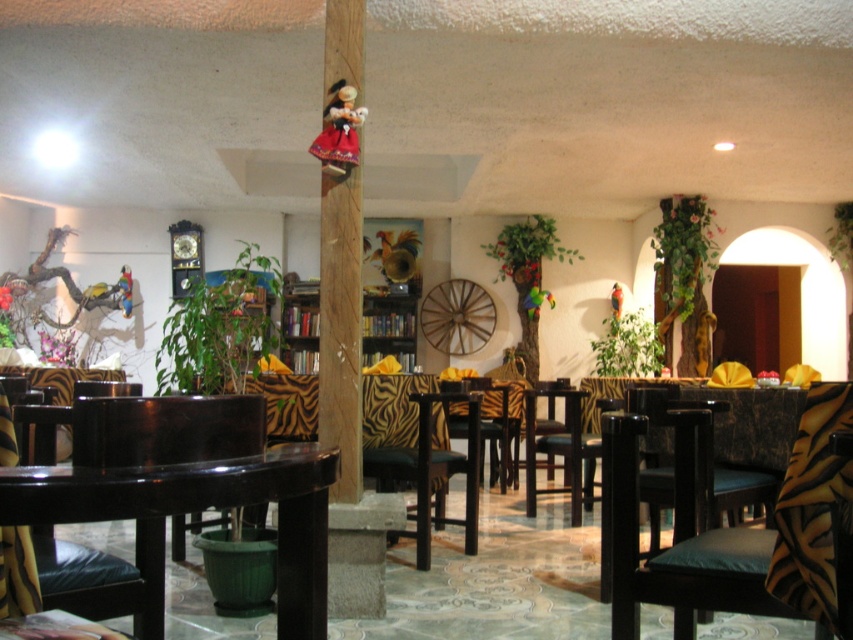
Who is positioned more to the right, glossy black table at lower left or zebra-patterned fabric armchair at center?

zebra-patterned fabric armchair at center

Does glossy black table at lower left have a greater height compared to zebra-patterned fabric armchair at center?

Incorrect, glossy black table at lower left's height is not larger of zebra-patterned fabric armchair at center's.

Who is more forward, [299,625] or [502,394]?

Positioned in front is point [299,625].

Identify the location of glossy black table at lower left. (196, 509).

Does point (190, 436) come farther from viewer compared to point (460, 432)?

No, it is not.

Identify the location of glossy wood armchair at center. This screenshot has height=640, width=853. (166, 429).

Can you confirm if zebra-patterned fabric armchair at center is smaller than wooden chair at center?

Yes.

Is zebra-patterned fabric armchair at center below wooden chair at center?

Indeed, zebra-patterned fabric armchair at center is positioned under wooden chair at center.

Measure the distance between point (502, 444) and camera.

Point (502, 444) and camera are 6.22 meters apart.

Locate an element on the screen. The height and width of the screenshot is (640, 853). zebra-patterned fabric armchair at center is located at coordinates (492, 432).